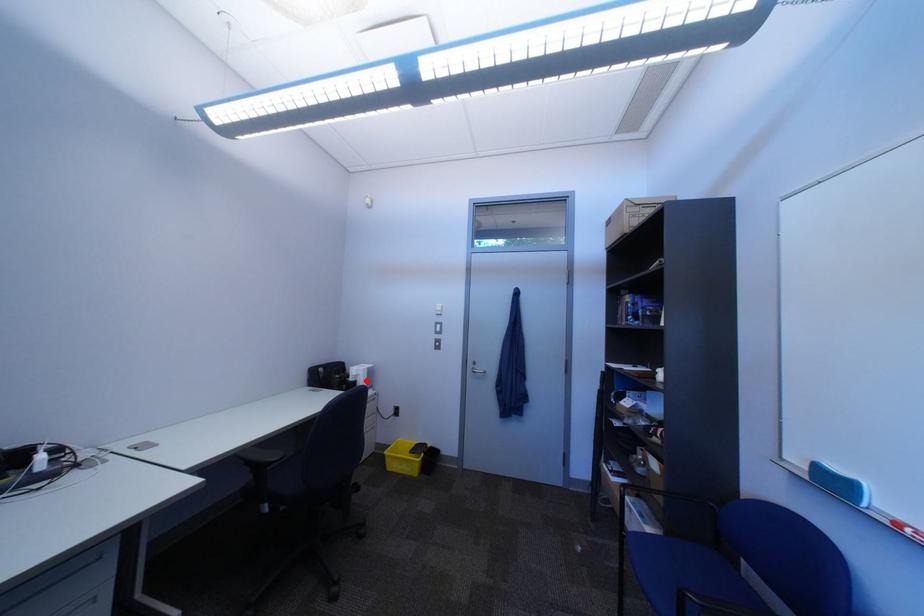
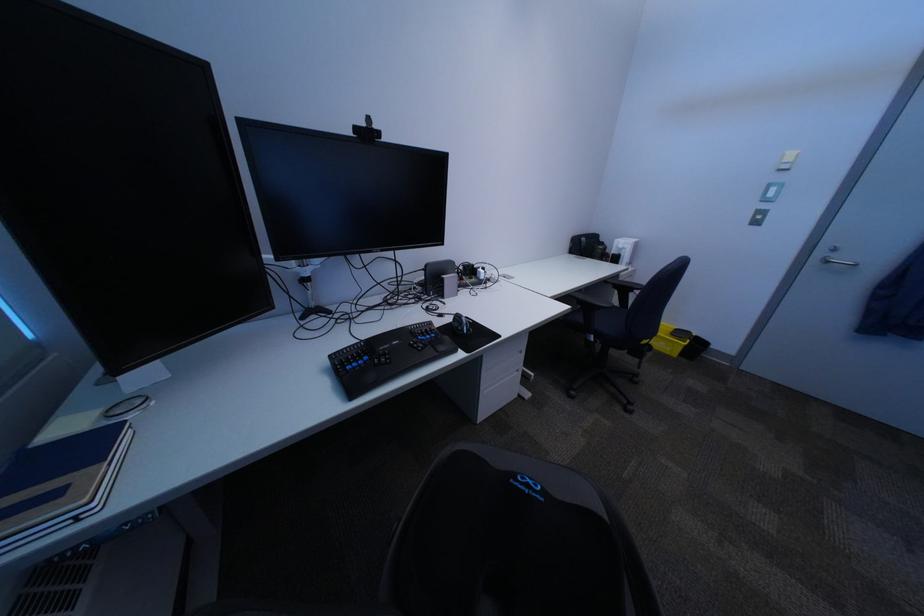
Question: I am providing you with two images of the same scene from different viewpoints. Given a red point in image1, look at the same physical point in image2. Is it:

Choices:
 (A) Closer to the viewpoint
 (B) Farther from the viewpoint

Answer: (A)